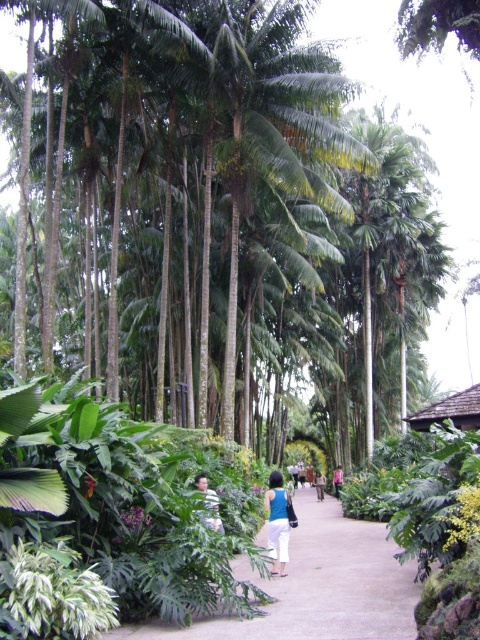
You are a photographer standing in the tropical garden, aiming to capture a person wearing the light blue fabric shirt at center and blue denim jeans at center. If you want to ensure both items of clothing are fully visible in the frame, which clothing item requires more space horizontally?

The blue denim jeans at center require more space horizontally because the blue denim jeans at center is wider than the light blue fabric shirt at center.

You are a photographer positioned at the entrance of the tropical garden pathway. You notice a person wearing a light blue fabric shirt at center and blue denim jeans at center. To frame your shot, you want to ensure the shirt is visible. Should you position the camera to the left or right of the person?

The light blue fabric shirt at center is to the left of blue denim jeans at center. To ensure the shirt is visible, position the camera to the right of the person so the shirt remains in view.

You are standing on the paved pathway in the tropical garden and want to walk towards the point labeled as point (280, 540). There is another point labeled point (218, 515) further ahead. Which point will you reach first?

You will reach point (280, 540) first because it is closer to you than point (218, 515), which is further away.